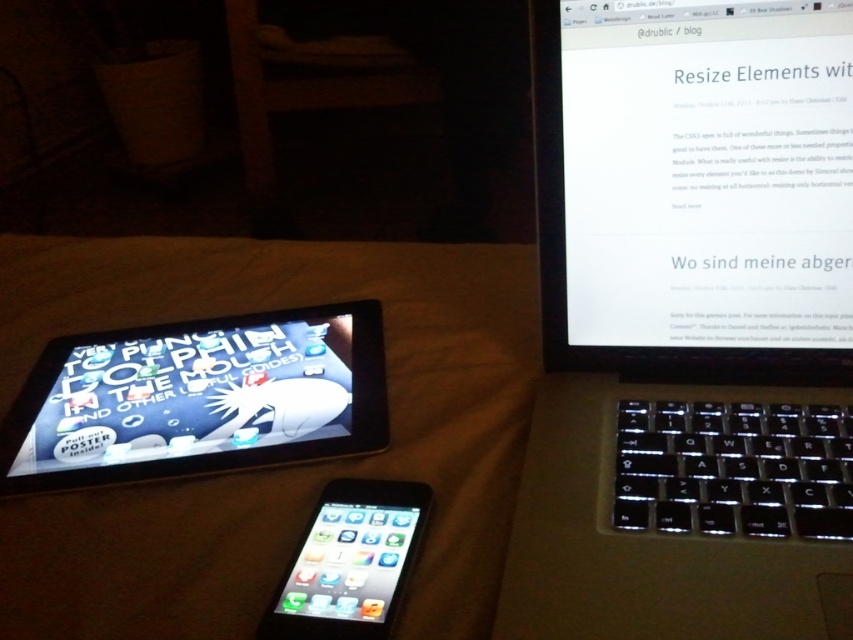
Is black plastic laptop at center to the right of matte black tablet at lower left from the viewer's perspective?

Indeed, black plastic laptop at center is positioned on the right side of matte black tablet at lower left.

Is black plastic laptop at center further to the viewer compared to matte black tablet at lower left?

No, black plastic laptop at center is in front of matte black tablet at lower left.

Is point (842, 588) behind point (323, 588)?

No, (842, 588) is in front of (323, 588).

Where is `black plastic laptop at center`? This screenshot has height=640, width=853. black plastic laptop at center is located at coordinates (689, 323).

Based on the photo, can you confirm if black plastic laptop at center is thinner than matte black tablet at left?

Correct, black plastic laptop at center's width is less than matte black tablet at left's.

Does black plastic laptop at center have a lesser height compared to matte black tablet at left?

In fact, black plastic laptop at center may be taller than matte black tablet at left.

Which is behind, point (686, 385) or point (292, 440)?

Point (686, 385)

The height and width of the screenshot is (640, 853). Find the location of `black plastic laptop at center`. black plastic laptop at center is located at coordinates (689, 323).

Is white glossy screen at upper center positioned before matte black tablet at left?

Yes, it is.

Who is more forward, (601, 296) or (380, 385)?

Positioned in front is point (601, 296).

Does point (637, 152) come farther from viewer compared to point (248, 380)?

No, (637, 152) is closer to viewer.

You are a GUI agent. You are given a task and a screenshot of the screen. Output one action in this format:
    pyautogui.click(x=<x>, y=<y>)
    Task: Click on the white glossy screen at upper center
    Image resolution: width=853 pixels, height=640 pixels.
    Given the screenshot: What is the action you would take?
    pyautogui.click(x=706, y=172)